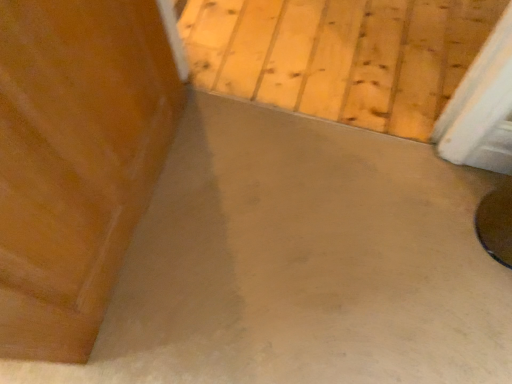
Question: Is smooth concrete floor at center not close to shiny brown table at lower right?

Choices:
 (A) yes
 (B) no

Answer: (B)

Question: Can you confirm if smooth concrete floor at center is taller than shiny brown table at lower right?

Choices:
 (A) no
 (B) yes

Answer: (A)

Question: Is smooth concrete floor at center located outside shiny brown table at lower right?

Choices:
 (A) no
 (B) yes

Answer: (B)

Question: Can you confirm if smooth concrete floor at center is thinner than shiny brown table at lower right?

Choices:
 (A) yes
 (B) no

Answer: (B)

Question: From a real-world perspective, is smooth concrete floor at center located beneath shiny brown table at lower right?

Choices:
 (A) no
 (B) yes

Answer: (B)

Question: Does smooth concrete floor at center have a larger size compared to shiny brown table at lower right?

Choices:
 (A) no
 (B) yes

Answer: (B)

Question: Is shiny brown table at lower right shorter than smooth concrete floor at center?

Choices:
 (A) yes
 (B) no

Answer: (B)

Question: Considering the relative sizes of shiny brown table at lower right and smooth concrete floor at center in the image provided, is shiny brown table at lower right wider than smooth concrete floor at center?

Choices:
 (A) yes
 (B) no

Answer: (B)

Question: From the image's perspective, is shiny brown table at lower right under smooth concrete floor at center?

Choices:
 (A) no
 (B) yes

Answer: (B)

Question: Can you confirm if shiny brown table at lower right is thinner than smooth concrete floor at center?

Choices:
 (A) yes
 (B) no

Answer: (A)

Question: Considering the relative positions of shiny brown table at lower right and smooth concrete floor at center in the image provided, is shiny brown table at lower right to the right of smooth concrete floor at center from the viewer's perspective?

Choices:
 (A) yes
 (B) no

Answer: (A)

Question: Can you see shiny brown table at lower right touching smooth concrete floor at center?

Choices:
 (A) no
 (B) yes

Answer: (A)

Question: Considering the relative positions of shiny brown table at lower right and smooth concrete floor at center in the image provided, is shiny brown table at lower right to the left or to the right of smooth concrete floor at center?

Choices:
 (A) left
 (B) right

Answer: (B)